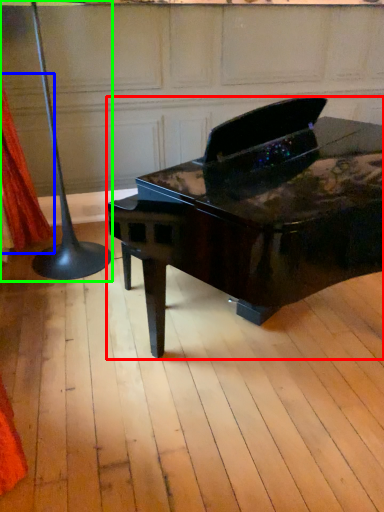
Question: Which is farther away from piano (highlighted by a red box)? curtain (highlighted by a blue box) or table lamp (highlighted by a green box)?

Choices:
 (A) curtain
 (B) table lamp

Answer: (A)